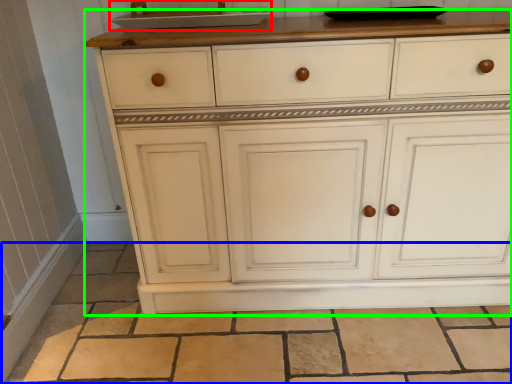
Question: Which object is positioned closest to sink (highlighted by a red box)? Select from tile (highlighted by a blue box) and chest of drawers (highlighted by a green box).

Choices:
 (A) tile
 (B) chest of drawers

Answer: (B)